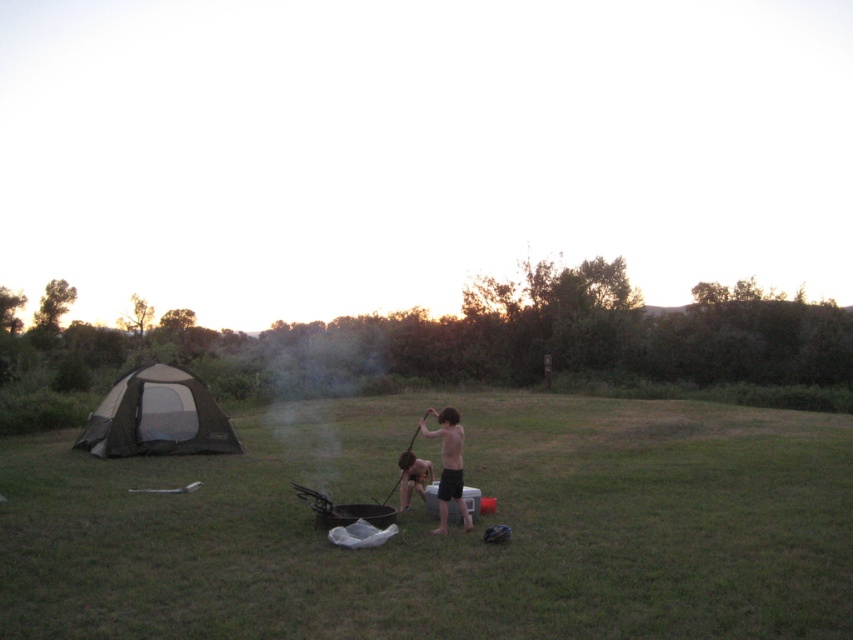
Does point (28, 636) come farther from viewer compared to point (462, 500)?

No, it is in front of (462, 500).

Does black matte grill at center have a lesser width compared to shiny black shorts at center?

No, black matte grill at center is not thinner than shiny black shorts at center.

What do you see at coordinates (450, 528) in the screenshot? I see `black matte grill at center` at bounding box center [450, 528].

What are the coordinates of `black matte grill at center` in the screenshot? It's located at (450, 528).

What do you see at coordinates (157, 417) in the screenshot? The width and height of the screenshot is (853, 640). I see `black mesh tent at left` at bounding box center [157, 417].

Can you confirm if black mesh tent at left is positioned to the left of shiny black shorts at center?

Indeed, black mesh tent at left is positioned on the left side of shiny black shorts at center.

At what (x,y) coordinates should I click in order to perform the action: click on black mesh tent at left. Please return your answer as a coordinate pair (x, y). Looking at the image, I should click on (157, 417).

Locate an element on the screen. The height and width of the screenshot is (640, 853). black mesh tent at left is located at coordinates (157, 417).

In the scene shown: Which is below, black matte grill at center or black mesh tent at left?

Positioned lower is black matte grill at center.

Which is more to the left, black matte grill at center or black mesh tent at left?

A: black mesh tent at left is more to the left.

Where is `black matte grill at center`? This screenshot has width=853, height=640. black matte grill at center is located at coordinates (450, 528).